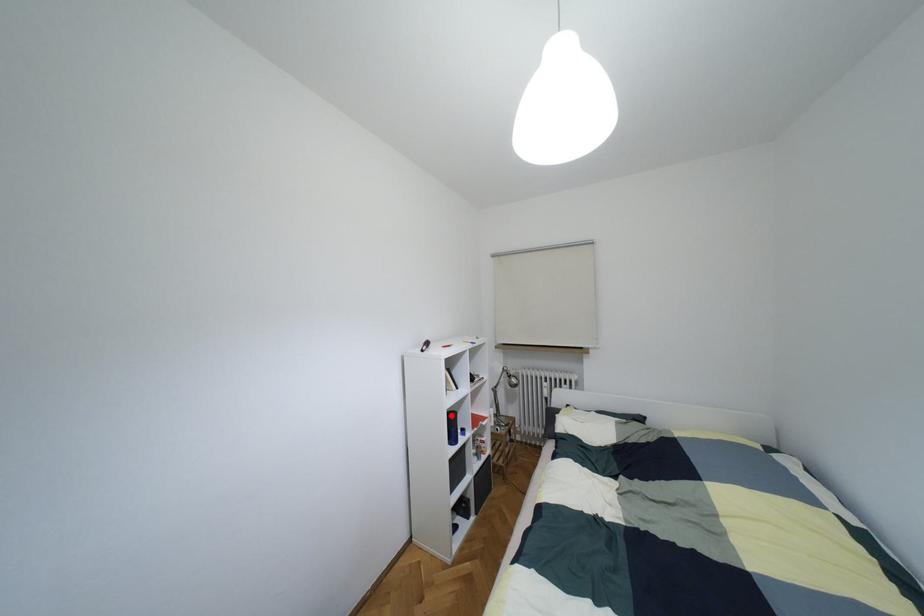
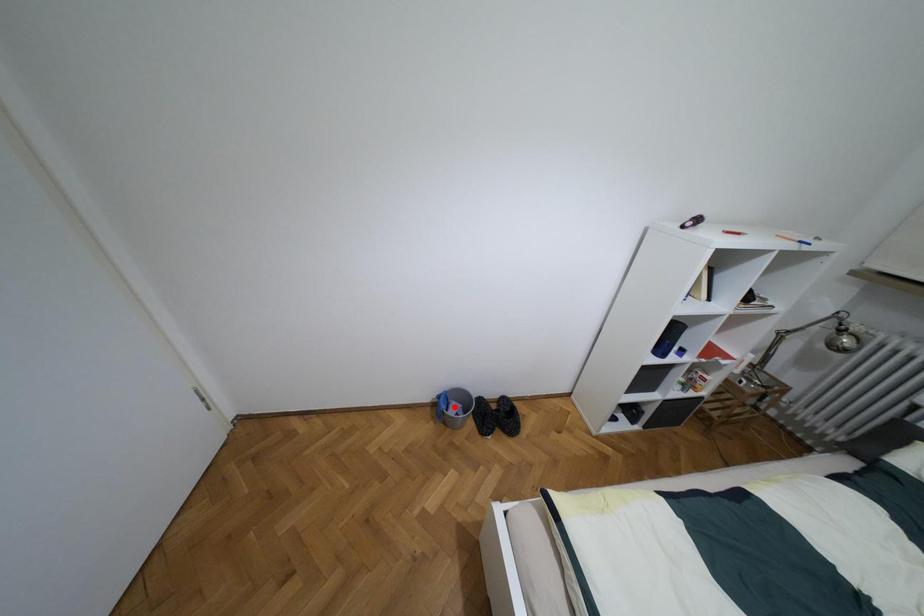
I am providing you with two images of the same scene from different viewpoints. A red point is marked on the first image and another point is marked on the second image. Do the highlighted points in image1 and image2 indicate the same real-world spot?

No